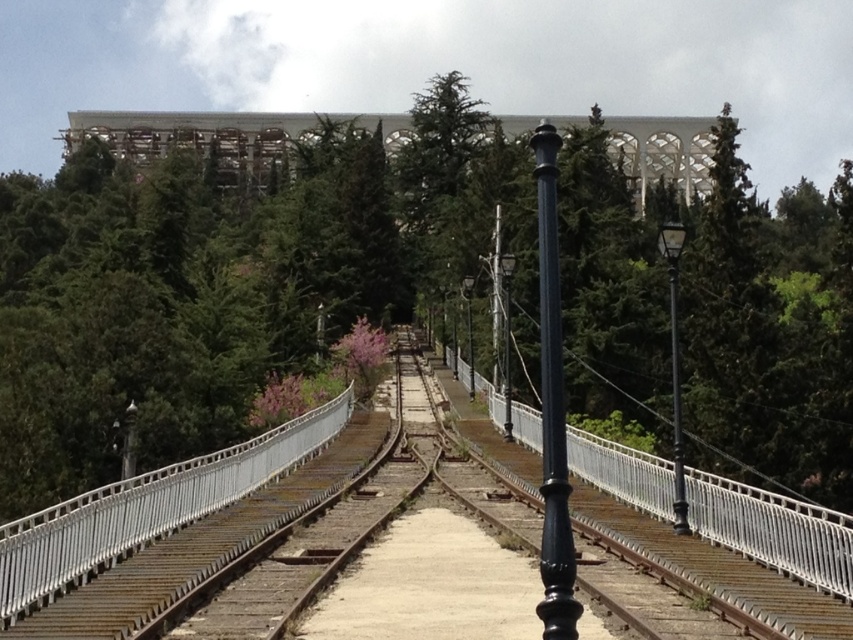
You are a maintenance worker on the railway bridge. You need to inspect the black polished metal pole at center. From your current position on the white concrete bridge at upper center, which direction should you move to reach the pole?

The white concrete bridge at upper center is positioned over the black polished metal pole at center, so you should move downward from the white concrete bridge at upper center to reach the black polished metal pole at center.

You are a maintenance worker on the railway bridge. You need to inspect both the white concrete bridge at upper center and the black metal rail at center. Which object is located above the other?

The white concrete bridge at upper center is positioned over the black metal rail at center, so the white concrete bridge at upper center is above the black metal rail at center.

In the scene shown: You are a bird looking for a place to perch. You see a green leafy tree at center and a black polished metal pole at center. Which one is taller?

The green leafy tree at center is taller than the black polished metal pole at center, so the bird should choose the green leafy tree at center to perch on.